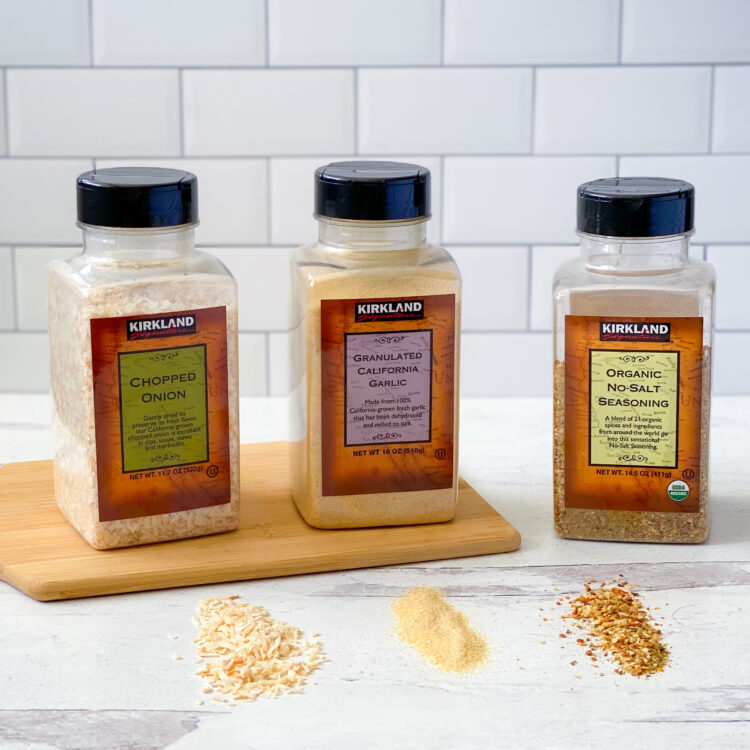
You are a GUI agent. You are given a task and a screenshot of the screen. Output one action in this format:
    pyautogui.click(x=<x>, y=<y>)
    Task: Click on the wooden cutting board
    
    Given the screenshot: What is the action you would take?
    pyautogui.click(x=247, y=549)